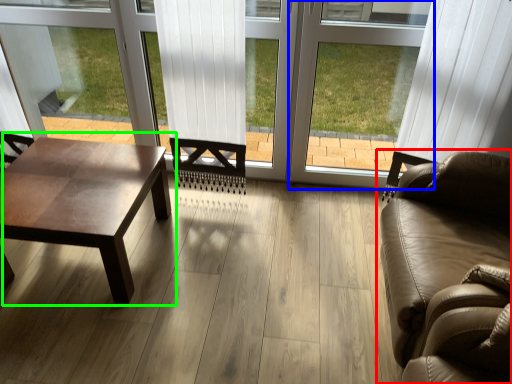
Question: Estimate the real-world distances between objects in this image. Which object is farther from studio couch (highlighted by a red box), window frame (highlighted by a blue box) or coffee table (highlighted by a green box)?

Choices:
 (A) window frame
 (B) coffee table

Answer: (B)